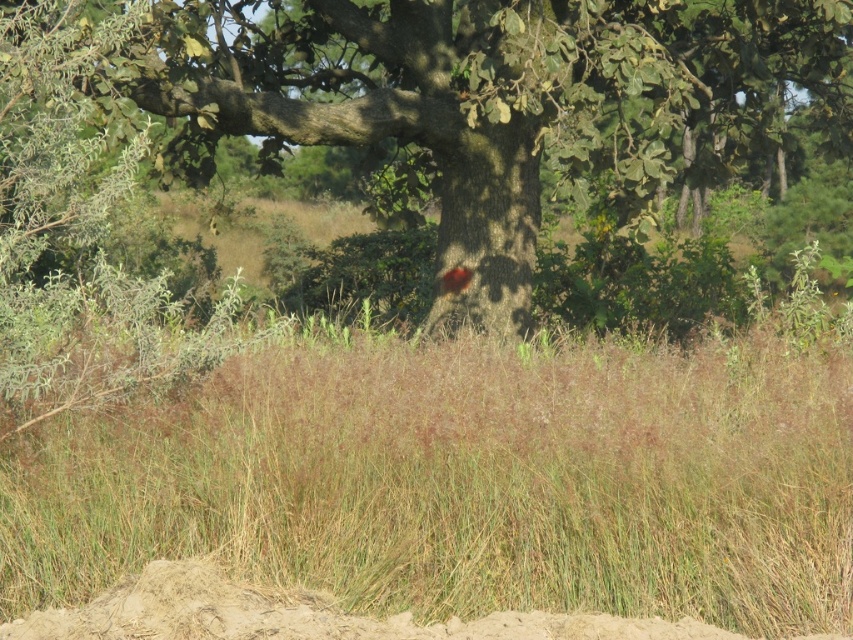
Question: Does green grass at center have a lesser width compared to green rough bark tree at center?

Choices:
 (A) no
 (B) yes

Answer: (B)

Question: Among these points, which one is farthest from the camera?

Choices:
 (A) (808, 356)
 (B) (521, 61)

Answer: (B)

Question: Can you confirm if green grass at center is positioned below green rough bark tree at center?

Choices:
 (A) yes
 (B) no

Answer: (A)

Question: Which object appears closest to the camera in this image?

Choices:
 (A) green rough bark tree at center
 (B) green grass at center

Answer: (B)

Question: Which of the following is the farthest from the observer?

Choices:
 (A) (781, 144)
 (B) (463, 538)

Answer: (A)

Question: Does green grass at center appear on the left side of green rough bark tree at center?

Choices:
 (A) no
 (B) yes

Answer: (B)